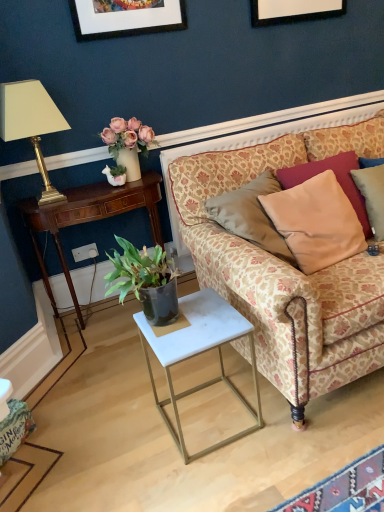
What do you see at coordinates (90, 218) in the screenshot? The image size is (384, 512). I see `mahogany wood desk at left` at bounding box center [90, 218].

What is the approximate height of green matte houseplant at upper left?

14.10 inches.

I want to click on white marble table at lower center, so click(x=198, y=354).

You are a GUI agent. You are given a task and a screenshot of the screen. Output one action in this format:
    pyautogui.click(x=<x>, y=<y>)
    Task: Click on the white plastic power outlet at lower left
    The image size is (384, 512).
    Given the screenshot: What is the action you would take?
    pyautogui.click(x=85, y=252)

Describe the element at coordinates (285, 265) in the screenshot. I see `patterned fabric couch at right` at that location.

Where is `beige fabric pillow at upper right, marked as the first pillow in a front-to-back arrangement`? This screenshot has height=512, width=384. beige fabric pillow at upper right, marked as the first pillow in a front-to-back arrangement is located at coordinates (316, 222).

Looking at their sizes, would you say mahogany wood desk at left is wider or thinner than white fabric lampshade at left?

Clearly, mahogany wood desk at left has more width compared to white fabric lampshade at left.

From the image's perspective, is mahogany wood desk at left on top of white fabric lampshade at left?

No.

Is point (145, 187) closer to viewer compared to point (15, 127)?

That is False.

Is mahogany wood desk at left not within white fabric lampshade at left?

Yes.

From the image's perspective, between white fabric lampshade at left and white plastic power outlet at lower left, which one is located above?

white fabric lampshade at left.

Considering the sizes of objects white fabric lampshade at left and white plastic power outlet at lower left in the image provided, who is taller, white fabric lampshade at left or white plastic power outlet at lower left?

white fabric lampshade at left.

Can you confirm if white fabric lampshade at left is smaller than white plastic power outlet at lower left?

Actually, white fabric lampshade at left might be larger than white plastic power outlet at lower left.

In the image, is white fabric lampshade at left on the left side or the right side of white plastic power outlet at lower left?

white fabric lampshade at left is to the left of white plastic power outlet at lower left.

Is white plastic power outlet at lower left further to camera compared to beige fabric pillow at upper right, marked as the first pillow in a front-to-back arrangement?

Yes, the depth of white plastic power outlet at lower left is greater than that of beige fabric pillow at upper right, marked as the first pillow in a front-to-back arrangement.

Is there a large distance between white plastic power outlet at lower left and beige fabric pillow at upper right, marked as the first pillow in a front-to-back arrangement?

white plastic power outlet at lower left is far away from beige fabric pillow at upper right, marked as the first pillow in a front-to-back arrangement.

From a real-world perspective, is white plastic power outlet at lower left above or below beige fabric pillow at upper right, which is the second pillow in back-to-front order?

In terms of real-world spatial position, white plastic power outlet at lower left is below beige fabric pillow at upper right, which is the second pillow in back-to-front order.

How many degrees apart are the facing directions of white plastic power outlet at lower left and beige fabric pillow at upper right, marked as the first pillow in a front-to-back arrangement?

There is a 1.68-degree angle between the facing directions of white plastic power outlet at lower left and beige fabric pillow at upper right, marked as the first pillow in a front-to-back arrangement.

From a real-world perspective, does white plastic power outlet at lower left sit lower than white fabric lampshade at left?

Yes, from a real-world perspective, white plastic power outlet at lower left is below white fabric lampshade at left.

This screenshot has height=512, width=384. Identify the location of power outlet that is on the right side of white fabric lampshade at left. (85, 252).

Would you say white plastic power outlet at lower left is inside or outside white fabric lampshade at left?

white plastic power outlet at lower left is not enclosed by white fabric lampshade at left.

Which of these two, white plastic power outlet at lower left or white fabric lampshade at left, is bigger?

Bigger between the two is white fabric lampshade at left.

Considering the relative positions of white marble table at lower center and white plastic power outlet at lower left in the image provided, is white marble table at lower center to the right of white plastic power outlet at lower left from the viewer's perspective?

Indeed, white marble table at lower center is positioned on the right side of white plastic power outlet at lower left.

Would you say white marble table at lower center is a long distance from white plastic power outlet at lower left?

Yes, white marble table at lower center and white plastic power outlet at lower left are quite far apart.

What's the angular difference between white marble table at lower center and white plastic power outlet at lower left's facing directions?

white marble table at lower center and white plastic power outlet at lower left are facing 0.0732 degrees away from each other.

Which of these two, white marble table at lower center or white plastic power outlet at lower left, stands shorter?

Standing shorter between the two is white plastic power outlet at lower left.

Is beige fabric pillow at upper right, which is the second pillow in back-to-front order, inside the boundaries of white plastic power outlet at lower left, or outside?

beige fabric pillow at upper right, which is the second pillow in back-to-front order, exists outside the volume of white plastic power outlet at lower left.

In terms of size, does beige fabric pillow at upper right, marked as the first pillow in a front-to-back arrangement, appear bigger or smaller than white plastic power outlet at lower left?

In the image, beige fabric pillow at upper right, marked as the first pillow in a front-to-back arrangement, appears to be larger than white plastic power outlet at lower left.

From a real-world perspective, does beige fabric pillow at upper right, marked as the first pillow in a front-to-back arrangement, sit lower than white plastic power outlet at lower left?

No, from a real-world perspective, beige fabric pillow at upper right, marked as the first pillow in a front-to-back arrangement, is not beneath white plastic power outlet at lower left.

Is the surface of beige fabric pillow at upper right, marked as the first pillow in a front-to-back arrangement, in direct contact with white plastic power outlet at lower left?

They are not placed beside each other.

Is patterned fabric couch at right not inside white marble table at lower center?

Yes, patterned fabric couch at right is not within white marble table at lower center.

Can you tell me how much patterned fabric couch at right and white marble table at lower center differ in facing direction?

The facing directions of patterned fabric couch at right and white marble table at lower center are 0.00251 degrees apart.

Looking at this image, does patterned fabric couch at right turn towards white marble table at lower center?

No, patterned fabric couch at right is not facing towards white marble table at lower center.

Which is closer to the camera, (248, 169) or (223, 336)?

Point (248, 169) appears to be farther away from the viewer than point (223, 336).

This screenshot has width=384, height=512. I want to click on lamp above the mahogany wood desk at left (from the image's perspective), so click(x=31, y=124).

Locate an element on the screen. lamp in front of the white plastic power outlet at lower left is located at coordinates (31, 124).

Which object lies nearer to the anchor point white fabric lampshade at left, white plastic power outlet at lower left or green matte houseplant at upper left?

green matte houseplant at upper left is positioned closer to the anchor white fabric lampshade at left.

From the image, which object appears to be farther from patterned fabric couch at right, beige fabric pillow at upper right, marked as the first pillow in a front-to-back arrangement, or beige fabric pillow at right, acting as the first pillow starting from the back?

The object further to patterned fabric couch at right is beige fabric pillow at right, acting as the first pillow starting from the back.

Considering their positions, is beige fabric pillow at right, the second pillow positioned from the front, positioned further to patterned fabric couch at right than beige fabric pillow at upper right, marked as the first pillow in a front-to-back arrangement?

The object further to patterned fabric couch at right is beige fabric pillow at right, the second pillow positioned from the front.

Based on their spatial positions, is beige fabric pillow at upper right, which is the second pillow in back-to-front order, or white plastic power outlet at lower left further from patterned fabric couch at right?

Based on the image, white plastic power outlet at lower left appears to be further to patterned fabric couch at right.

From the image, which object appears to be nearer to white plastic power outlet at lower left, beige fabric pillow at upper right, which is the second pillow in back-to-front order, or white marble table at lower center?

Based on the image, white marble table at lower center appears to be nearer to white plastic power outlet at lower left.

Which object lies further to the anchor point beige fabric pillow at upper right, which is the second pillow in back-to-front order, white plastic power outlet at lower left or white marble table at lower center?

white plastic power outlet at lower left is further to beige fabric pillow at upper right, which is the second pillow in back-to-front order.

Based on their spatial positions, is patterned fabric couch at right or white fabric lampshade at left further from white plastic power outlet at lower left?

The object further to white plastic power outlet at lower left is patterned fabric couch at right.

Looking at the image, which one is located further to beige fabric pillow at right, acting as the first pillow starting from the back, patterned fabric couch at right or beige fabric pillow at upper right, which is the second pillow in back-to-front order?

The object further to beige fabric pillow at right, acting as the first pillow starting from the back, is patterned fabric couch at right.

You are a GUI agent. You are given a task and a screenshot of the screen. Output one action in this format:
    pyautogui.click(x=<x>, y=<y>)
    Task: Click on the table located between white fabric lampshade at left and beige fabric pillow at upper right, marked as the first pillow in a front-to-back arrangement, in the left-right direction
    The height and width of the screenshot is (512, 384).
    Given the screenshot: What is the action you would take?
    click(198, 354)

Locate an element on the screen. This screenshot has width=384, height=512. table positioned between patterned fabric couch at right and white plastic power outlet at lower left from near to far is located at coordinates (198, 354).

Locate an element on the screen. pillow situated between mahogany wood desk at left and beige fabric pillow at right, acting as the first pillow starting from the back, from left to right is located at coordinates (316, 222).

Where is `houseplant located between patterned fabric couch at right and white plastic power outlet at lower left in the depth direction`? The image size is (384, 512). houseplant located between patterned fabric couch at right and white plastic power outlet at lower left in the depth direction is located at coordinates (128, 144).